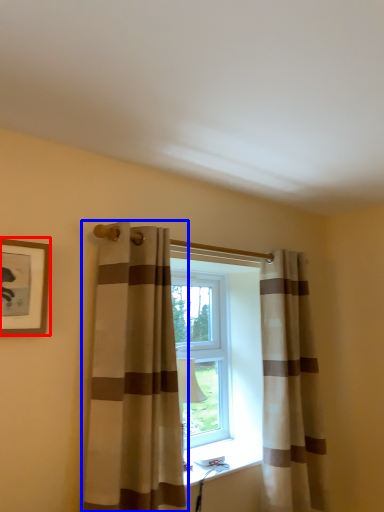
Question: Which object is further to the camera taking this photo, picture frame (highlighted by a red box) or curtain (highlighted by a blue box)?

Choices:
 (A) picture frame
 (B) curtain

Answer: (B)